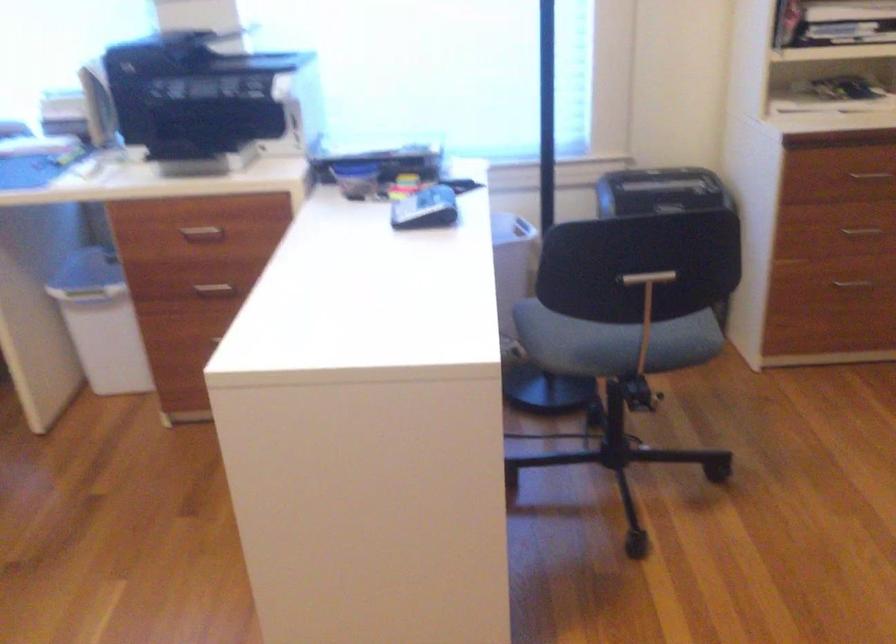
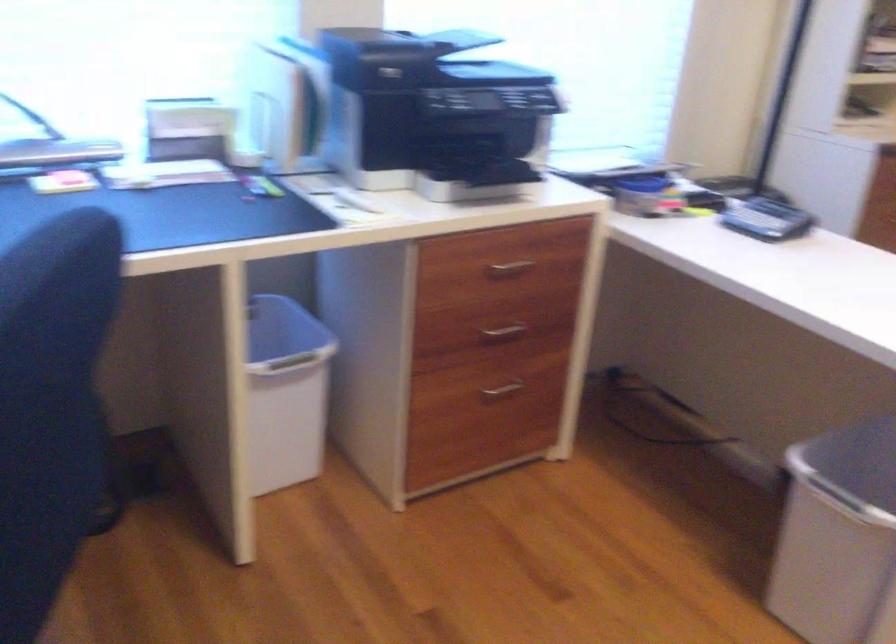
Find the pixel in the second image that matches pixel 216 232 in the first image.

(510, 268)